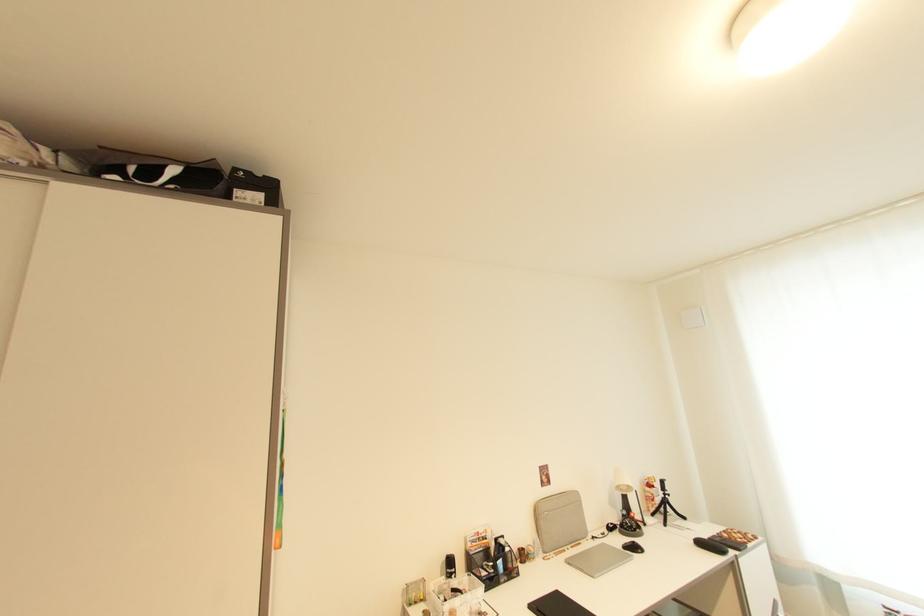
Find where to lift the silver laptop. Please return your answer as a coordinate pair (x, y).

(601, 559)